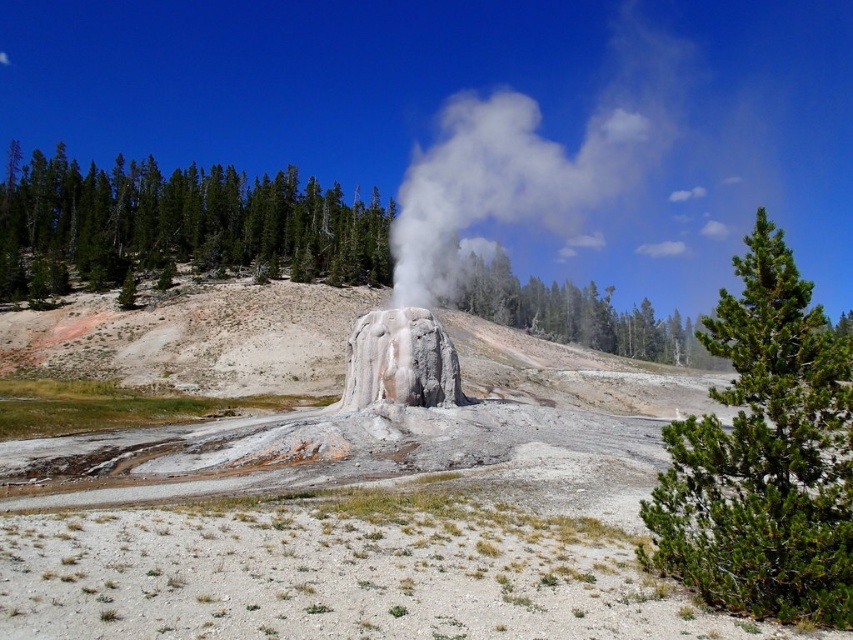
You are a GUI agent. You are given a task and a screenshot of the screen. Output one action in this format:
    pyautogui.click(x=<x>, y=<y>)
    Task: Click on the green needle-like tree at right
    
    Given the screenshot: What is the action you would take?
    pyautogui.click(x=764, y=456)

Does point (766, 307) come closer to viewer compared to point (26, 241)?

Yes, point (766, 307) is in front of point (26, 241).

The image size is (853, 640). Find the location of `green needle-like tree at right`. green needle-like tree at right is located at coordinates (764, 456).

Is green needle-like tree at right wider than gray stone geyser at center?

Yes.

Between green needle-like tree at right and gray stone geyser at center, which one has more height?

With more height is green needle-like tree at right.

This screenshot has height=640, width=853. What do you see at coordinates (764, 456) in the screenshot?
I see `green needle-like tree at right` at bounding box center [764, 456].

You are a GUI agent. You are given a task and a screenshot of the screen. Output one action in this format:
    pyautogui.click(x=<x>, y=<y>)
    Task: Click on the green needle-like tree at right
    
    Given the screenshot: What is the action you would take?
    pyautogui.click(x=764, y=456)

Which is behind, point (577, 339) or point (792, 616)?

Positioned behind is point (577, 339).

Between green textured rock at center and green needle-like tree at right, which one is positioned higher?

green textured rock at center is higher up.

Find the location of a particular element. green textured rock at center is located at coordinates (177, 225).